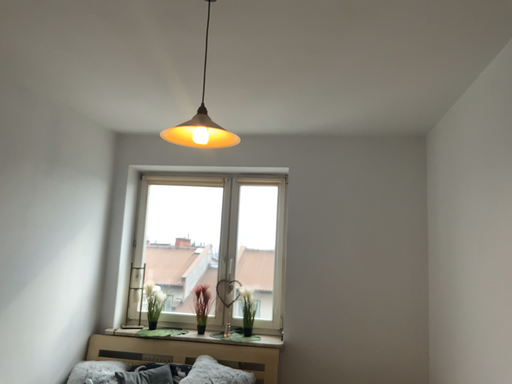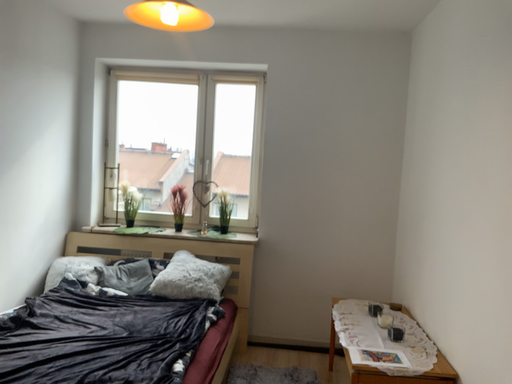
Question: How did the camera likely rotate when shooting the video?

Choices:
 (A) rotated downward
 (B) rotated upward

Answer: (A)